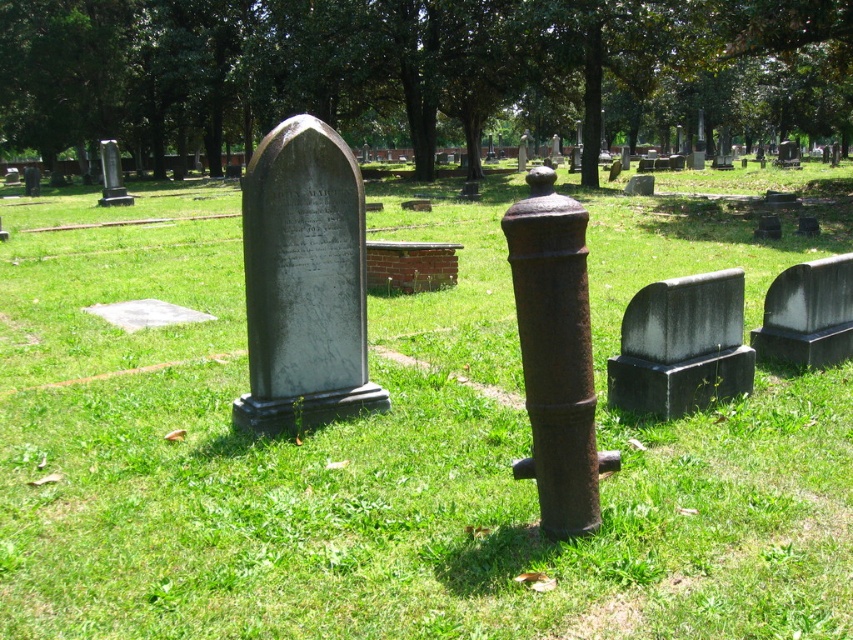
Question: Which of the following is the farthest from the observer?

Choices:
 (A) gray polished stone gravestone at center
 (B) smooth gray stone at center right
 (C) brick at center

Answer: (C)

Question: Which of the following is the closest to the observer?

Choices:
 (A) rusty metal pole at center
 (B) smooth gray stone at center right
 (C) brick at center
 (D) black marble gravestone at lower right

Answer: (A)

Question: Based on their relative distances, which object is farther from the rusty metal pole at center?

Choices:
 (A) brick at center
 (B) black marble gravestone at lower right
 (C) gray polished stone gravestone at center
 (D) smooth gray stone at center right

Answer: (A)

Question: Is the position of smooth gray stone at center right less distant than that of brick at center?

Choices:
 (A) no
 (B) yes

Answer: (B)

Question: Can you confirm if rusty metal pole at center is smaller than black marble gravestone at lower right?

Choices:
 (A) yes
 (B) no

Answer: (A)

Question: Does smooth gray stone at center right have a smaller size compared to brick at center?

Choices:
 (A) yes
 (B) no

Answer: (A)